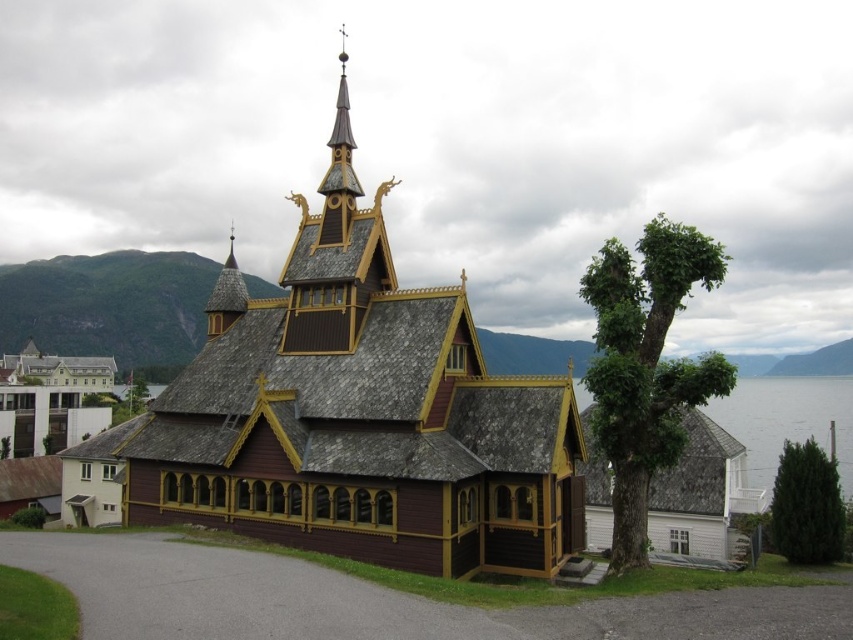
Does brown wooden church at lower left come behind green leafy tree at lower right?

Yes, it is behind green leafy tree at lower right.

Is point (97, 394) positioned after point (805, 556)?

Yes, point (97, 394) is farther from viewer.

Locate an element on the screen. brown wooden church at lower left is located at coordinates (50, 401).

From the picture: Is green leafy tree at right to the left of brown wooden church at lower left from the viewer's perspective?

In fact, green leafy tree at right is to the right of brown wooden church at lower left.

Locate an element on the screen. The height and width of the screenshot is (640, 853). green leafy tree at right is located at coordinates (646, 365).

Does brown wooden chapel at center have a lesser height compared to green leafy tree at lower right?

Incorrect, brown wooden chapel at center's height does not fall short of green leafy tree at lower right's.

Can you confirm if brown wooden chapel at center is smaller than green leafy tree at lower right?

Indeed, brown wooden chapel at center has a smaller size compared to green leafy tree at lower right.

Measure the distance between brown wooden chapel at center and camera.

The distance of brown wooden chapel at center from camera is 37.28 meters.

Identify the location of brown wooden chapel at center. The image size is (853, 640). (358, 413).